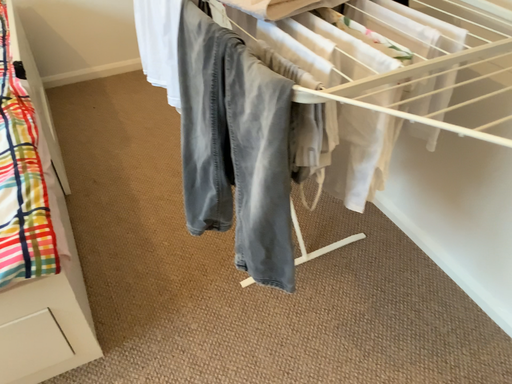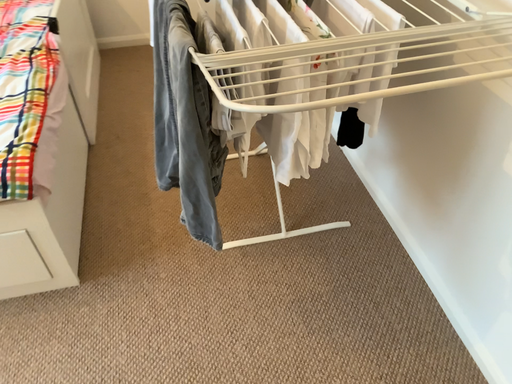
Question: How did the camera likely rotate when shooting the video?

Choices:
 (A) rotated left
 (B) rotated right

Answer: (A)